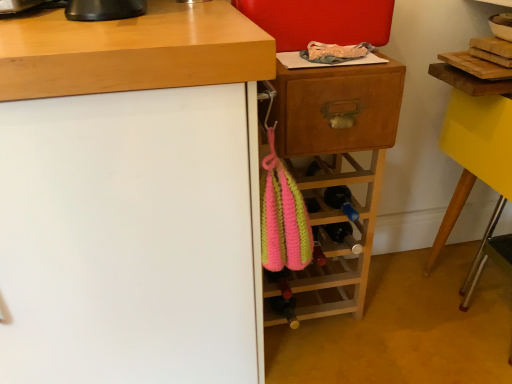
The width and height of the screenshot is (512, 384). What do you see at coordinates (339, 244) in the screenshot?
I see `pink knitted bag at center` at bounding box center [339, 244].

In order to click on white matte cabinet at left in this screenshot , I will do `click(132, 197)`.

This screenshot has width=512, height=384. What do you see at coordinates (132, 197) in the screenshot?
I see `white matte cabinet at left` at bounding box center [132, 197].

Measure the distance between yellow glossy table at right and camera.

A distance of 93.86 centimeters exists between yellow glossy table at right and camera.

In order to click on pink knitted bottle at center in this screenshot , I will do `click(284, 300)`.

What is the approximate height of pink knitted bottle at center?

2.13 inches.

Locate an element on the screen. This screenshot has width=512, height=384. wooden drawer at upper right is located at coordinates (339, 113).

Is pink knitted bag at center smaller than yellow glossy table at right?

Yes, pink knitted bag at center is smaller than yellow glossy table at right.

Find the location of a particular element. computer desk positioned vertically above the pink knitted bag at center (from a real-world perspective) is located at coordinates (476, 161).

Which is correct: pink knitted bag at center is inside yellow glossy table at right, or outside of it?

pink knitted bag at center is spatially situated outside yellow glossy table at right.

Is pink knitted bottle at center with pink knitted bag at center?

No, pink knitted bottle at center is not with pink knitted bag at center.

Between pink knitted bottle at center and pink knitted bag at center, which one is positioned behind?

pink knitted bottle at center is further away from the camera.

Considering the relative sizes of pink knitted bottle at center and pink knitted bag at center in the image provided, is pink knitted bottle at center bigger than pink knitted bag at center?

No, pink knitted bottle at center is not bigger than pink knitted bag at center.

Between pink knitted bottle at center and pink knitted bag at center, which one appears on the left side from the viewer's perspective?

From the viewer's perspective, pink knitted bottle at center appears more on the left side.

Which point is more forward, (300, 285) or (287, 295)?

The point (287, 295) is closer.

How distant is pink knitted bag at center from pink knitted bottle at center?

pink knitted bag at center and pink knitted bottle at center are 7.15 inches apart.

From the image's perspective, is pink knitted bag at center located above pink knitted bottle at center?

Yes.

Is pink knitted bag at center turned away from pink knitted bottle at center?

pink knitted bag at center is not turned away from pink knitted bottle at center.

From the image's perspective, is pink knitted bag at center under wooden drawer at upper right?

Indeed, from the image's perspective, pink knitted bag at center is shown beneath wooden drawer at upper right.

How many degrees apart are the facing directions of pink knitted bag at center and wooden drawer at upper right?

The angle between the facing direction of pink knitted bag at center and the facing direction of wooden drawer at upper right is 1.74 degrees.

Does pink knitted bag at center turn towards wooden drawer at upper right?

No, pink knitted bag at center is not oriented towards wooden drawer at upper right.

Is pink knitted bag at center not inside wooden drawer at upper right?

pink knitted bag at center lies outside wooden drawer at upper right's area.

Between yellow glossy table at right and pink knitted bag at center, which one is positioned behind?

pink knitted bag at center is behind.

Image resolution: width=512 pixels, height=384 pixels. What are the coordinates of `shelf below the yellow glossy table at right (from a real-world perspective)` in the screenshot? It's located at (339, 244).

Can you tell me how much yellow glossy table at right and pink knitted bag at center differ in facing direction?

They differ by 89.3 degrees in their facing directions.

From the picture: Considering the positions of objects yellow glossy table at right and pink knitted bag at center in the image provided, who is more to the right, yellow glossy table at right or pink knitted bag at center?

Positioned to the right is yellow glossy table at right.

Are wooden drawer at upper right and pink knitted bag at center far apart?

No.

Between wooden drawer at upper right and pink knitted bag at center, which one has smaller width?

wooden drawer at upper right.

Is wooden drawer at upper right bigger or smaller than pink knitted bag at center?

wooden drawer at upper right is smaller than pink knitted bag at center.

Is wooden drawer at upper right facing away from pink knitted bag at center?

wooden drawer at upper right is not turned away from pink knitted bag at center.

Is yellow glossy table at right next to pink knitted bottle at center?

No, yellow glossy table at right is not in contact with pink knitted bottle at center.

Where is `bottle lying below the yellow glossy table at right (from the image's perspective)`? The image size is (512, 384). bottle lying below the yellow glossy table at right (from the image's perspective) is located at coordinates (284, 300).

Is yellow glossy table at right thinner than pink knitted bottle at center?

In fact, yellow glossy table at right might be wider than pink knitted bottle at center.

There is a pink knitted bag at center. In order to click on computer desk above it (from a real-world perspective) in this screenshot , I will do `click(476, 161)`.

This screenshot has width=512, height=384. Find the location of `bottle located behind the pink knitted bag at center`. bottle located behind the pink knitted bag at center is located at coordinates (284, 300).

Based on their spatial positions, is white matte cabinet at left or pink knitted bag at center closer to pink knitted bottle at center?

The object closer to pink knitted bottle at center is pink knitted bag at center.

Looking at the image, which one is located further to wooden drawer at upper right, pink knitted bag at center or pink knitted bottle at center?

The object further to wooden drawer at upper right is pink knitted bottle at center.

Looking at the image, which one is located further to yellow glossy table at right, wooden drawer at upper right or white matte cabinet at left?

Among the two, white matte cabinet at left is located further to yellow glossy table at right.

Estimate the real-world distances between objects in this image. Which object is further from pink knitted bottle at center, pink knitted bag at center or yellow glossy table at right?

yellow glossy table at right lies further to pink knitted bottle at center than the other object.

Consider the image. From the image, which object appears to be nearer to yellow glossy table at right, white matte cabinet at left or pink knitted bag at center?

The object closer to yellow glossy table at right is pink knitted bag at center.

From the image, which object appears to be farther from white matte cabinet at left, pink knitted bottle at center or wooden drawer at upper right?

Based on the image, pink knitted bottle at center appears to be further to white matte cabinet at left.

Which object lies further to the anchor point wooden drawer at upper right, yellow glossy table at right or white matte cabinet at left?

yellow glossy table at right is positioned further to the anchor wooden drawer at upper right.

Which object lies further to the anchor point wooden drawer at upper right, pink knitted bottle at center or pink knitted bag at center?

pink knitted bottle at center is further to wooden drawer at upper right.

At what (x,y) coordinates should I click in order to perform the action: click on shelf situated between pink knitted bottle at center and yellow glossy table at right from left to right. Please return your answer as a coordinate pair (x, y). Image resolution: width=512 pixels, height=384 pixels. Looking at the image, I should click on (339, 244).

Locate an element on the screen. The width and height of the screenshot is (512, 384). bottle between white matte cabinet at left and yellow glossy table at right is located at coordinates (284, 300).

Locate an element on the screen. The width and height of the screenshot is (512, 384). shelf between wooden drawer at upper right and yellow glossy table at right from left to right is located at coordinates (339, 244).

Identify the location of drawer situated between white matte cabinet at left and yellow glossy table at right from left to right. (339, 113).